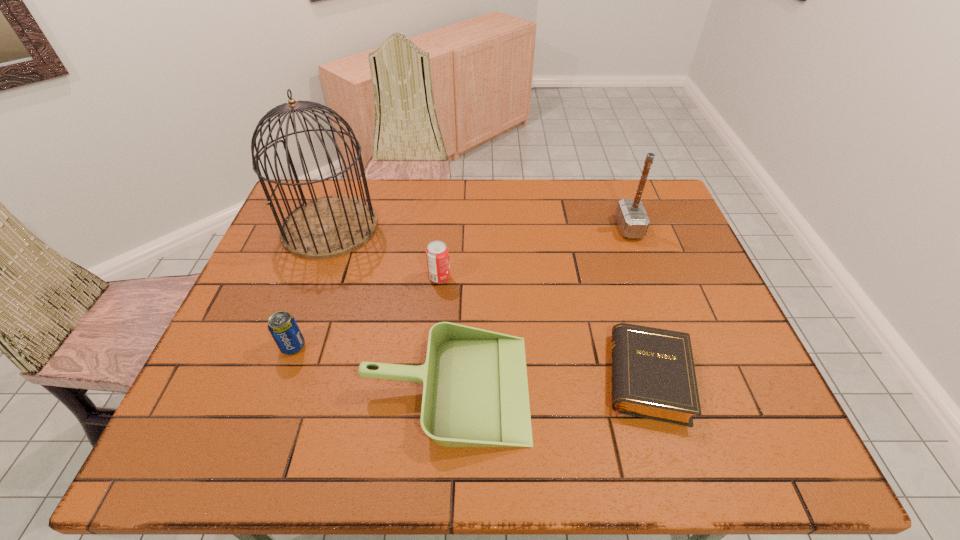
The image size is (960, 540). I want to click on birdcage, so click(331, 226).

Find the location of a particular element. hammer is located at coordinates (632, 219).

Identify the location of the farther soda. This screenshot has width=960, height=540. (437, 254).

Locate an element on the screen. the right soda is located at coordinates (437, 254).

This screenshot has width=960, height=540. What are the coordinates of `the nearer soda` in the screenshot? It's located at (283, 327).

Find the location of a particular element. the fifth tallest object is located at coordinates (475, 390).

Locate an element on the screen. Image resolution: width=960 pixels, height=540 pixels. the shortest object is located at coordinates (653, 376).

Where is `vacant region located 0.320m at the door of the birdcage`? This screenshot has width=960, height=540. vacant region located 0.320m at the door of the birdcage is located at coordinates (284, 352).

Where is `free location located 0.240m on the striking surface of the fifth shortest object`? This screenshot has width=960, height=540. free location located 0.240m on the striking surface of the fifth shortest object is located at coordinates (540, 228).

Locate an element on the screen. The width and height of the screenshot is (960, 540). vacant point located 0.180m on the striking surface of the fifth shortest object is located at coordinates pos(560,228).